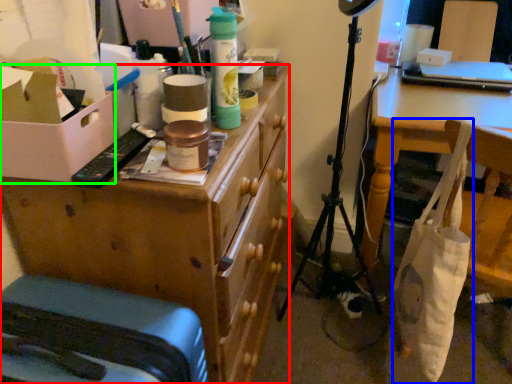
Question: Based on their relative distances, which object is nearer to desk (highlighted by a red box)? Choose from bag (highlighted by a blue box) and cardboard box (highlighted by a green box).

Choices:
 (A) bag
 (B) cardboard box

Answer: (B)